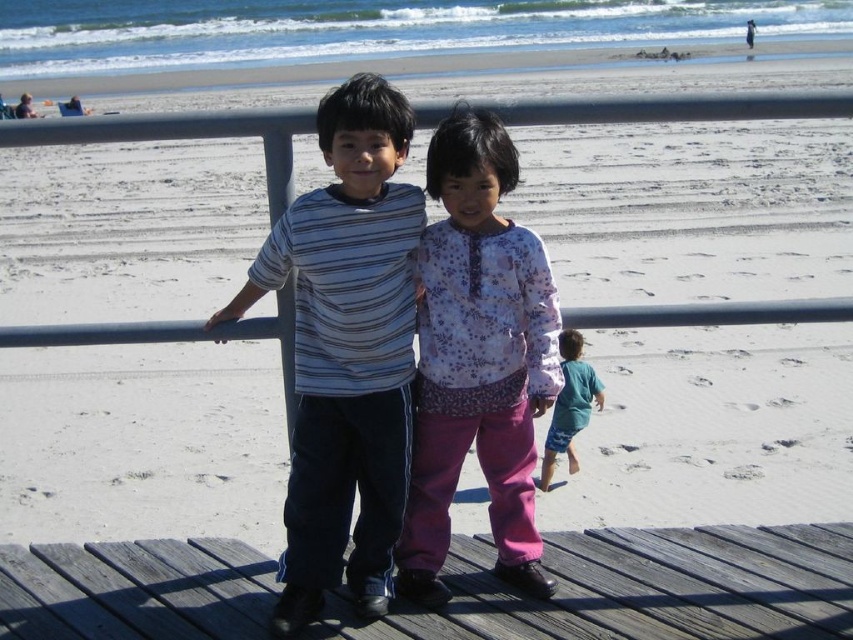
Between point (373, 573) and point (546, 490), which one is positioned in front?

Positioned in front is point (373, 573).

Is point (347, 113) more distant than point (577, 388)?

No, (347, 113) is closer to viewer.

This screenshot has height=640, width=853. I want to click on striped cotton shirt at center, so click(x=347, y=352).

Which of these two, wooden at lower center or striped cotton shirt at center, stands taller?

With more height is striped cotton shirt at center.

Can you confirm if wooden at lower center is taller than striped cotton shirt at center?

In fact, wooden at lower center may be shorter than striped cotton shirt at center.

Identify the location of wooden at lower center. (640, 588).

Between wooden at lower center and teal fabric shorts at lower right, which one has less height?

With less height is wooden at lower center.

Who is lower down, wooden at lower center or teal fabric shorts at lower right?

Positioned lower is wooden at lower center.

Between point (28, 605) and point (567, 426), which one is positioned behind?

Positioned behind is point (567, 426).

Identify the location of wooden at lower center. The image size is (853, 640). (640, 588).